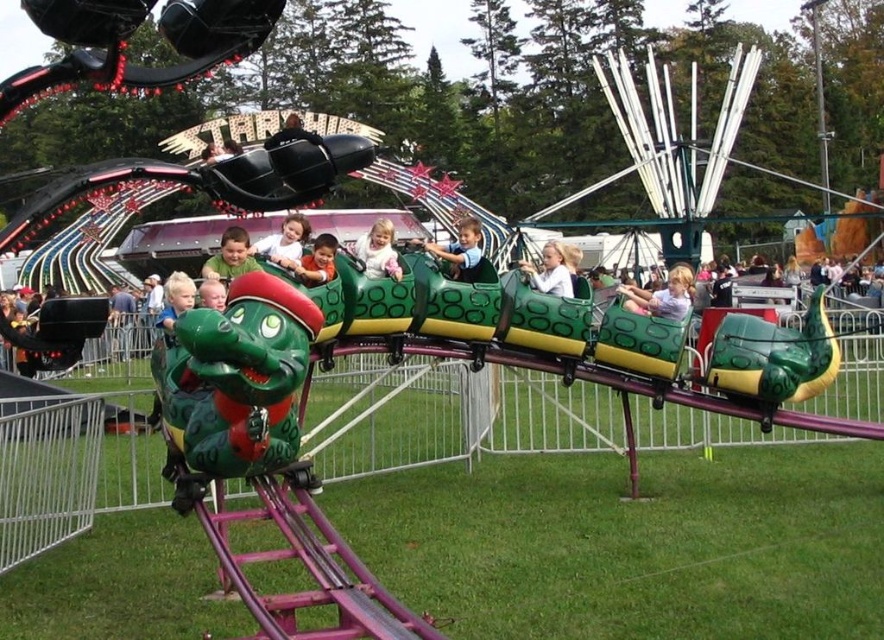
Based on the photo, you are a parent at the fairground holding a 3.5 feet wide umbrella. You want to walk from your current position to the green matte dragon at center while keeping the white matte dress at center in sight. Can you pass through the space between them without the umbrella hitting anything?

The distance between the white matte dress at center and the green matte dragon at center is 12.77 feet. Since the umbrella is only 3.5 feet wide, there is enough space for you to walk through the gap between them without the umbrella hitting either object.